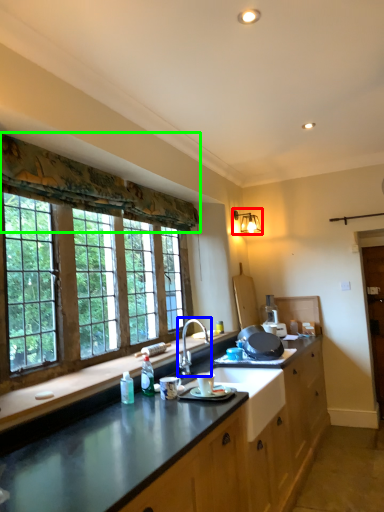
Question: Estimate the real-world distances between objects in this image. Which object is farther from light fixture (highlighted by a red box), sink (highlighted by a blue box) or curtain (highlighted by a green box)?

Choices:
 (A) sink
 (B) curtain

Answer: (A)